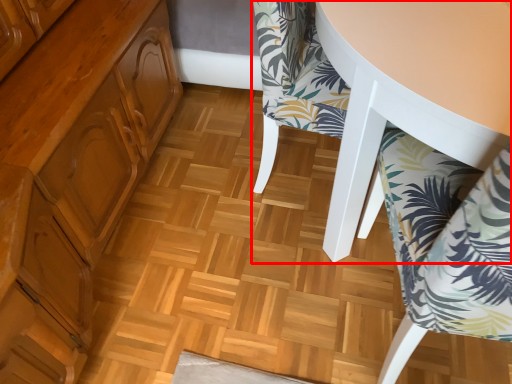
Question: Observing the image, what is the correct spatial positioning of chair (annotated by the red box) in reference to chair?

Choices:
 (A) left
 (B) right

Answer: (A)